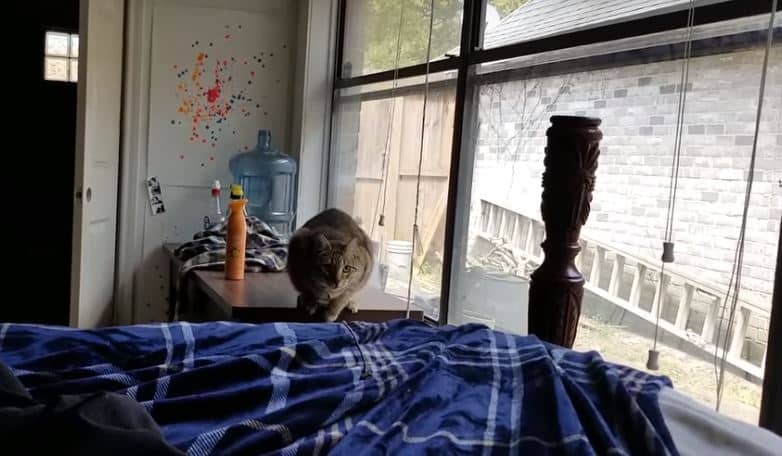
What are the coordinates of `ladder` in the screenshot? It's located at [x=637, y=283].